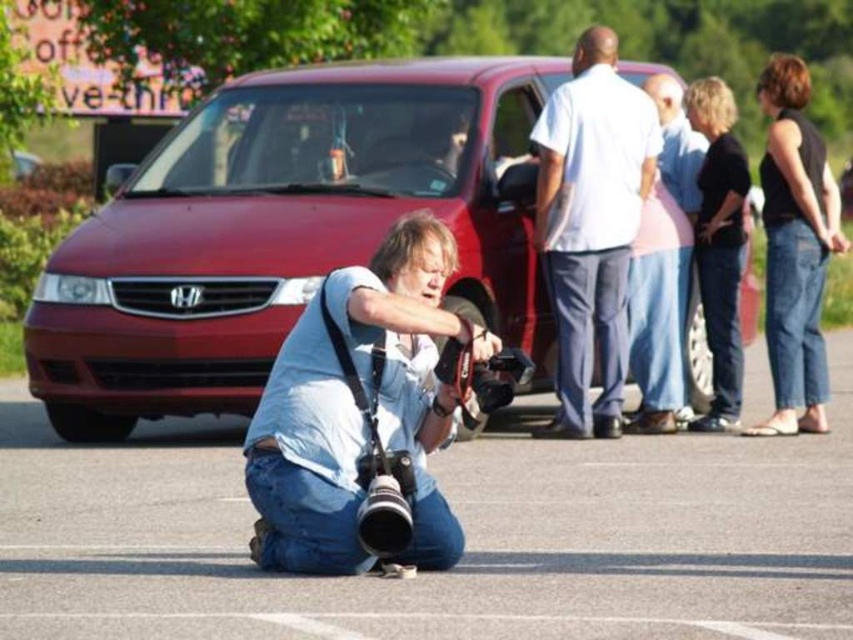
Who is lower down, white cotton shirt at upper center or pink cotton shirt at center?

pink cotton shirt at center is lower down.

Does white cotton shirt at upper center have a lesser width compared to pink cotton shirt at center?

In fact, white cotton shirt at upper center might be wider than pink cotton shirt at center.

Is point (604, 102) positioned after point (666, 236)?

No, (604, 102) is closer to viewer.

Find the location of a particular element. This screenshot has width=853, height=640. white cotton shirt at upper center is located at coordinates [590, 225].

Is blue denim jeans at lower center below pink cotton shirt at center?

Yes, blue denim jeans at lower center is below pink cotton shirt at center.

Is the position of blue denim jeans at lower center more distant than that of pink cotton shirt at center?

No, blue denim jeans at lower center is closer to the viewer.

Which is in front, point (273, 516) or point (676, 236)?

Point (273, 516) is in front.

You are a GUI agent. You are given a task and a screenshot of the screen. Output one action in this format:
    pyautogui.click(x=<x>, y=<y>)
    Task: Click on the blue denim jeans at lower center
    The height and width of the screenshot is (640, 853).
    Given the screenshot: What is the action you would take?
    pyautogui.click(x=358, y=410)

Which is below, blue denim jeans at lower center or black cotton shirt at upper right?

Positioned lower is blue denim jeans at lower center.

From the picture: Can you confirm if blue denim jeans at lower center is positioned above black cotton shirt at upper right?

Incorrect, blue denim jeans at lower center is not positioned above black cotton shirt at upper right.

Does point (332, 365) come farther from viewer compared to point (744, 180)?

No, it is not.

Locate an element on the screen. This screenshot has height=640, width=853. blue denim jeans at lower center is located at coordinates (358, 410).